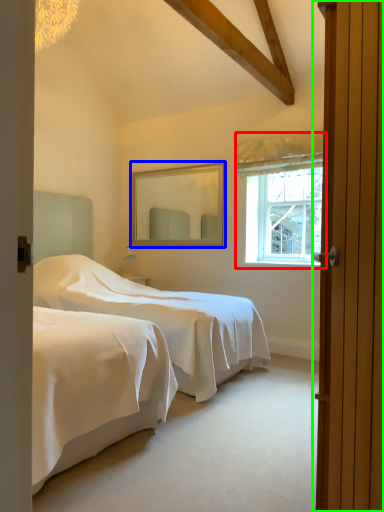
Question: Which object is positioned closest to window (highlighted by a red box)? Select from mirror (highlighted by a blue box) and door (highlighted by a green box).

Choices:
 (A) mirror
 (B) door

Answer: (A)